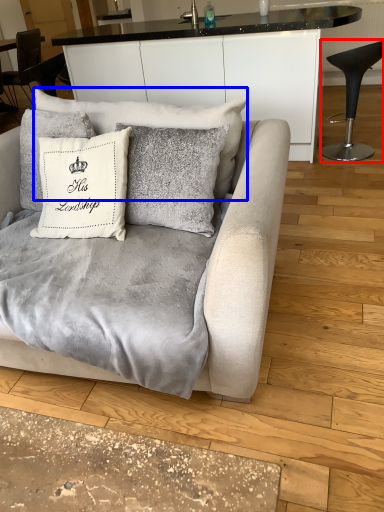
Question: Which of the following is the farthest to the observer, chair (highlighted by a red box) or pillow (highlighted by a blue box)?

Choices:
 (A) chair
 (B) pillow

Answer: (A)